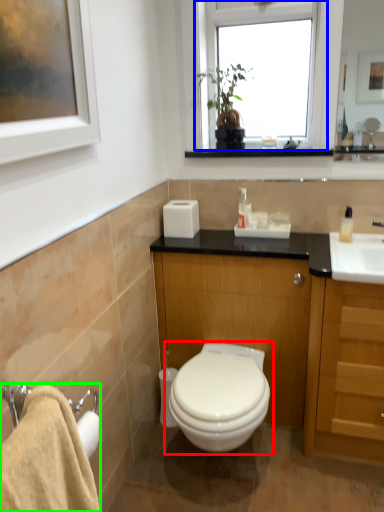
Question: Based on their relative distances, which object is nearer to toilet (highlighted by a red box)? Choose from window (highlighted by a blue box) and bath towel (highlighted by a green box).

Choices:
 (A) window
 (B) bath towel

Answer: (B)